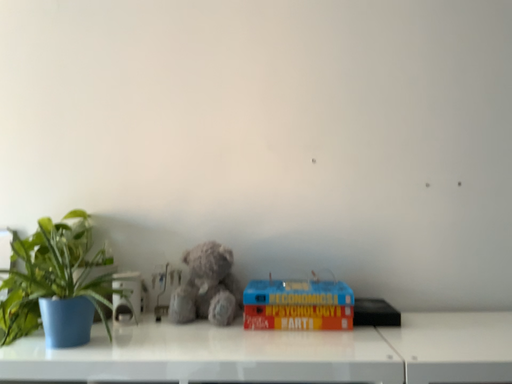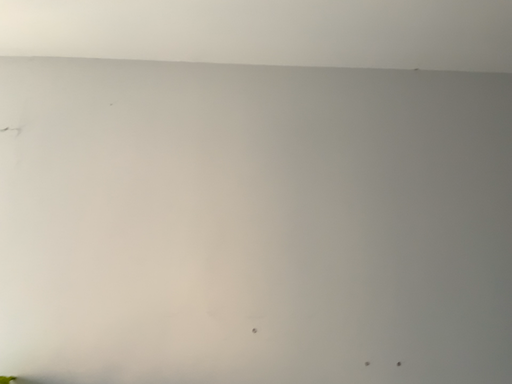
Question: Which way did the camera rotate in the video?

Choices:
 (A) rotated upward
 (B) rotated downward

Answer: (A)